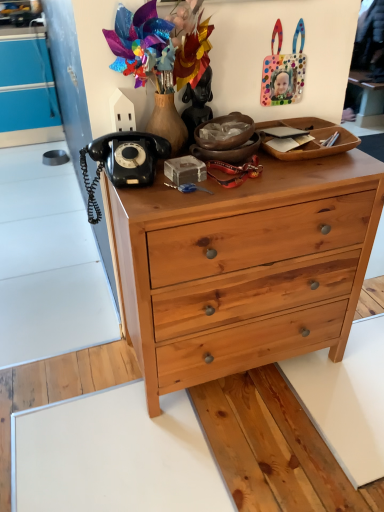
Question: From the image's perspective, would you say black matte statue at upper center is positioned over polka dot plastic handbag at upper right?

Choices:
 (A) no
 (B) yes

Answer: (A)

Question: From a real-world perspective, is black matte statue at upper center positioned under polka dot plastic handbag at upper right based on gravity?

Choices:
 (A) yes
 (B) no

Answer: (A)

Question: Is black matte statue at upper center not inside polka dot plastic handbag at upper right?

Choices:
 (A) yes
 (B) no

Answer: (A)

Question: Considering the relative sizes of black matte statue at upper center and polka dot plastic handbag at upper right in the image provided, is black matte statue at upper center wider than polka dot plastic handbag at upper right?

Choices:
 (A) no
 (B) yes

Answer: (B)

Question: Would you say polka dot plastic handbag at upper right is part of black matte statue at upper center's contents?

Choices:
 (A) no
 (B) yes

Answer: (A)

Question: Is black matte statue at upper center at the right side of polka dot plastic handbag at upper right?

Choices:
 (A) no
 (B) yes

Answer: (A)

Question: Does polka dot plastic handbag at upper right have a lesser height compared to natural wood chest of drawers at center?

Choices:
 (A) no
 (B) yes

Answer: (B)

Question: Is polka dot plastic handbag at upper right touching natural wood chest of drawers at center?

Choices:
 (A) no
 (B) yes

Answer: (A)

Question: From the image's perspective, is polka dot plastic handbag at upper right on top of natural wood chest of drawers at center?

Choices:
 (A) yes
 (B) no

Answer: (A)

Question: From the image's perspective, would you say polka dot plastic handbag at upper right is shown under natural wood chest of drawers at center?

Choices:
 (A) yes
 (B) no

Answer: (B)

Question: Is polka dot plastic handbag at upper right facing away from natural wood chest of drawers at center?

Choices:
 (A) yes
 (B) no

Answer: (B)

Question: Is polka dot plastic handbag at upper right to the left of natural wood chest of drawers at center from the viewer's perspective?

Choices:
 (A) no
 (B) yes

Answer: (A)

Question: From a real-world perspective, does black rubberized telephone at upper left sit lower than black matte statue at upper center?

Choices:
 (A) no
 (B) yes

Answer: (B)